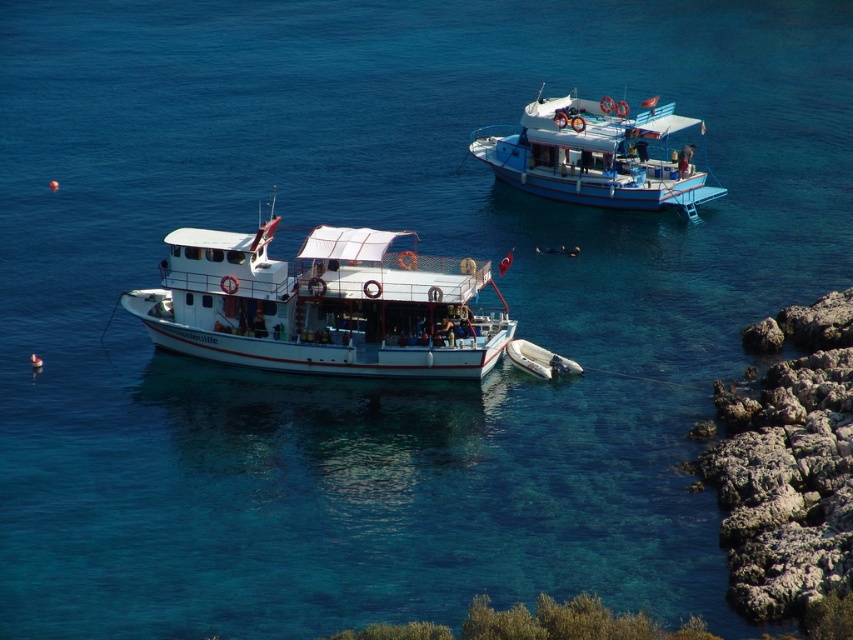
You are standing on the rocky shore and want to board the white matte boat at center. Based on its position, in which direction should you walk to reach it?

The white matte boat at center is located at point coordinates of [322,305]. Since the boat is at the center of the image, you should walk towards the middle area between the rocky shores to reach it.